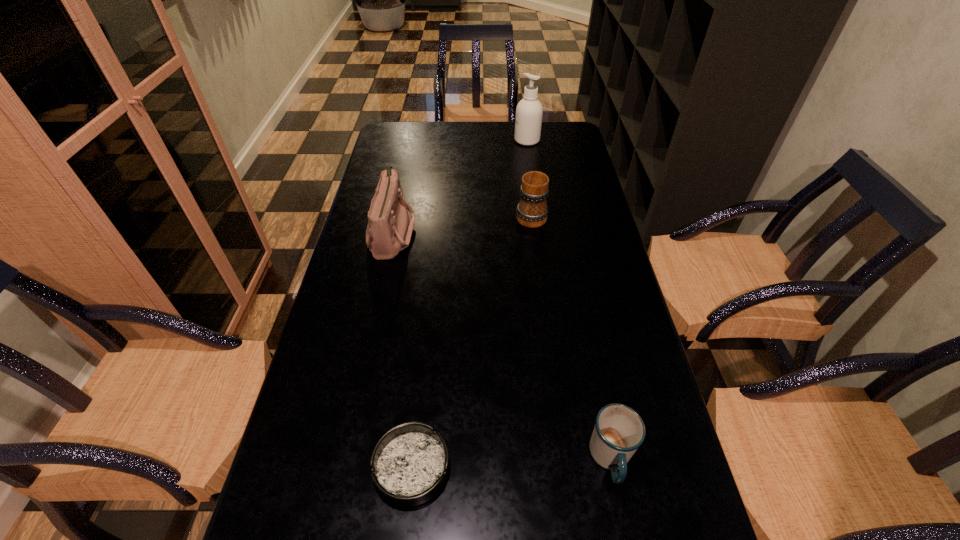
At what (x,y) coordinates should I click in order to perform the action: click on free space located 0.130m on the front label of the tallest object. Please return your answer as a coordinate pair (x, y). Looking at the image, I should click on (480, 140).

Identify the location of free space located 0.190m on the front pocket of the shoulder bag. Image resolution: width=960 pixels, height=540 pixels. (478, 233).

Where is `free location located 0.360m on the side of the taller mug with the handle`? This screenshot has height=540, width=960. free location located 0.360m on the side of the taller mug with the handle is located at coordinates (522, 144).

At what (x,y) coordinates should I click in order to perform the action: click on vacant space located on the side of the taller mug with the handle. Please return your answer as a coordinate pair (x, y). Looking at the image, I should click on (523, 153).

Identify the location of free space located 0.390m on the side of the taller mug with the handle. (521, 140).

At what (x,y) coordinates should I click in order to perform the action: click on vacant space located 0.050m on the handle side of the nearer mug. Please return your answer as a coordinate pair (x, y). Looking at the image, I should click on (624, 522).

The height and width of the screenshot is (540, 960). I want to click on vacant space located on the right of the ashtray, so click(x=661, y=467).

Find the location of a particular element. object situated at the far edge is located at coordinates click(x=529, y=111).

This screenshot has height=540, width=960. Find the location of `object located in the left edge section of the desktop`. object located in the left edge section of the desktop is located at coordinates (389, 230).

Identify the location of cleansing agent that is at the right edge. The image size is (960, 540). (529, 111).